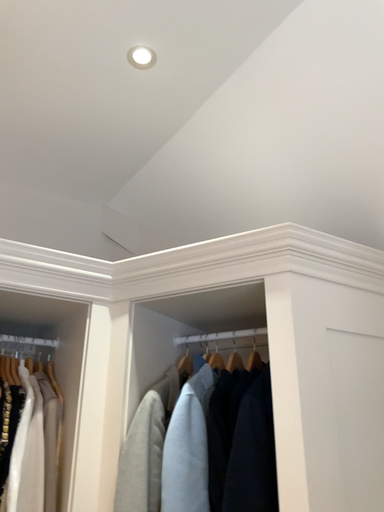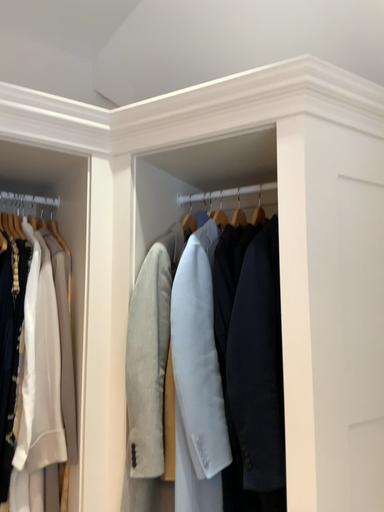
Question: Which way did the camera rotate in the video?

Choices:
 (A) rotated downward
 (B) rotated upward

Answer: (A)